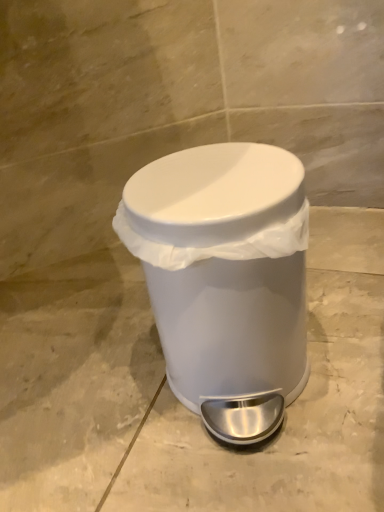
Describe the element at coordinates (225, 279) in the screenshot. Image resolution: width=384 pixels, height=512 pixels. I see `white plastic waste container at center` at that location.

The image size is (384, 512). Identify the location of white plastic waste container at center. (225, 279).

The width and height of the screenshot is (384, 512). I want to click on white plastic waste container at center, so click(225, 279).